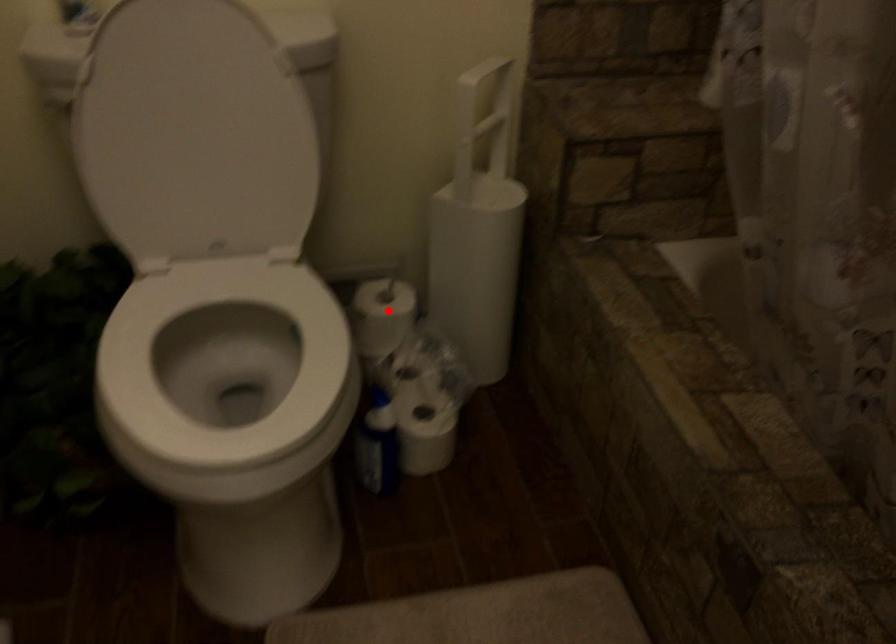
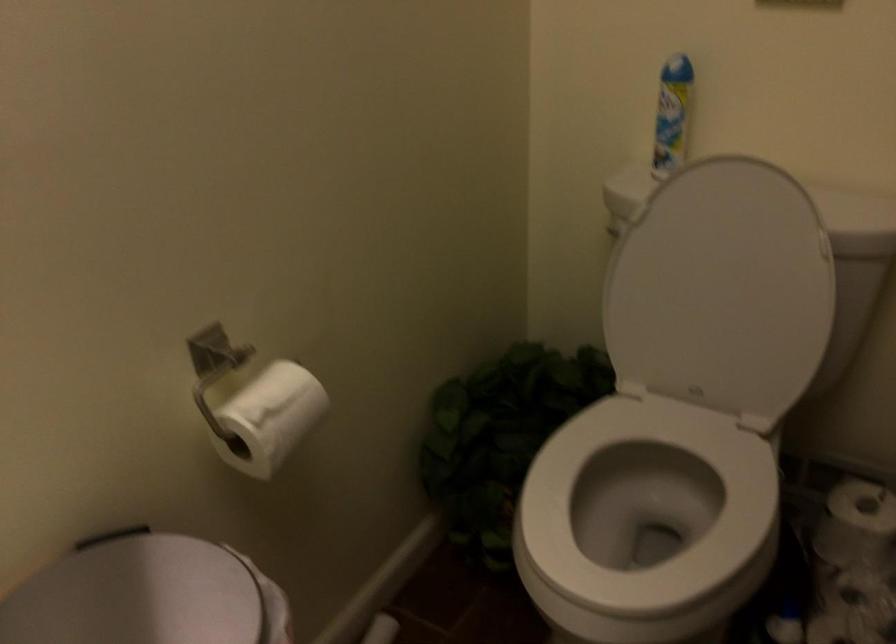
In the second image, find the point that corresponds to the highlighted location in the first image.

(856, 523)